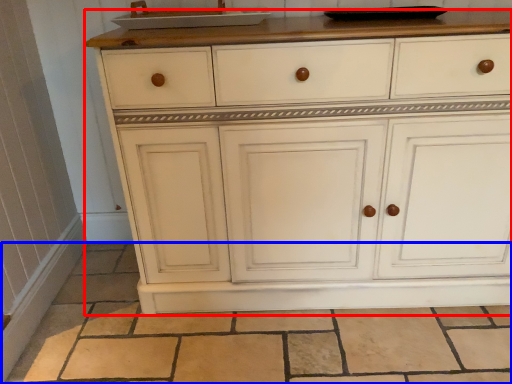
Question: Which point is further to the camera, chest of drawers (highlighted by a red box) or tile (highlighted by a blue box)?

Choices:
 (A) chest of drawers
 (B) tile

Answer: (B)